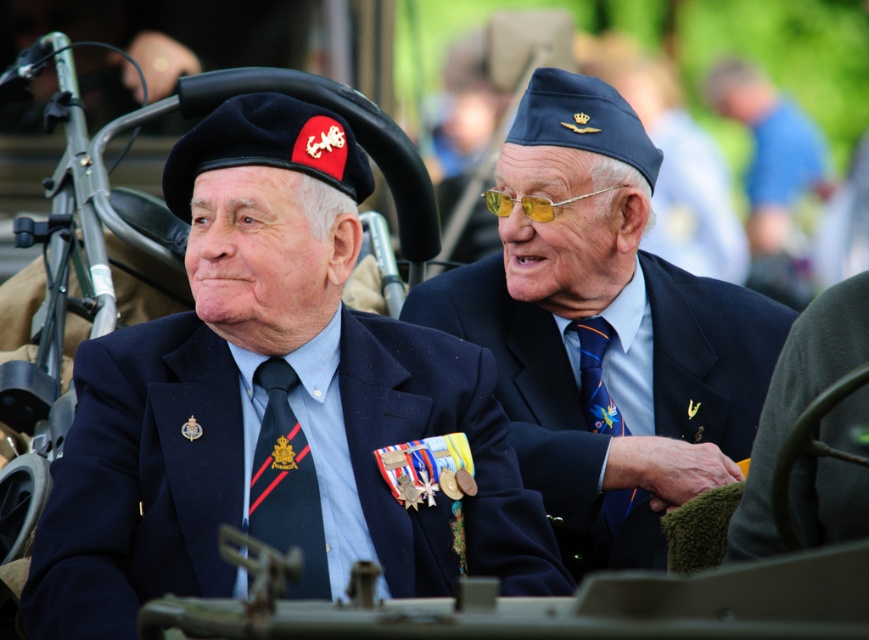
Which of these two, navy blue suit at center or multicolored silk tie at center, stands taller?

navy blue suit at center

Is point (315, 344) more distant than point (582, 376)?

That is False.

Does point (401, 564) come behind point (634, 493)?

No.

Find the location of a particular element. navy blue suit at center is located at coordinates (270, 404).

Which of these two, blue fabric cap at upper right or black silk tie at center, stands taller?

blue fabric cap at upper right is taller.

Is blue fabric cap at upper right to the right of black silk tie at center from the viewer's perspective?

Yes, blue fabric cap at upper right is to the right of black silk tie at center.

What are the coordinates of `blue fabric cap at upper right` in the screenshot? It's located at (604, 332).

Is blue fabric shirt at upper right smaller than multicolored silk tie at center?

Incorrect, blue fabric shirt at upper right is not smaller in size than multicolored silk tie at center.

Is blue fabric shirt at upper right bigger than multicolored silk tie at center?

Yes, blue fabric shirt at upper right is bigger than multicolored silk tie at center.

You are a GUI agent. You are given a task and a screenshot of the screen. Output one action in this format:
    pyautogui.click(x=<x>, y=<y>)
    Task: Click on the blue fabric shirt at upper right
    
    Given the screenshot: What is the action you would take?
    pyautogui.click(x=773, y=173)

I want to click on blue fabric shirt at upper right, so click(x=773, y=173).